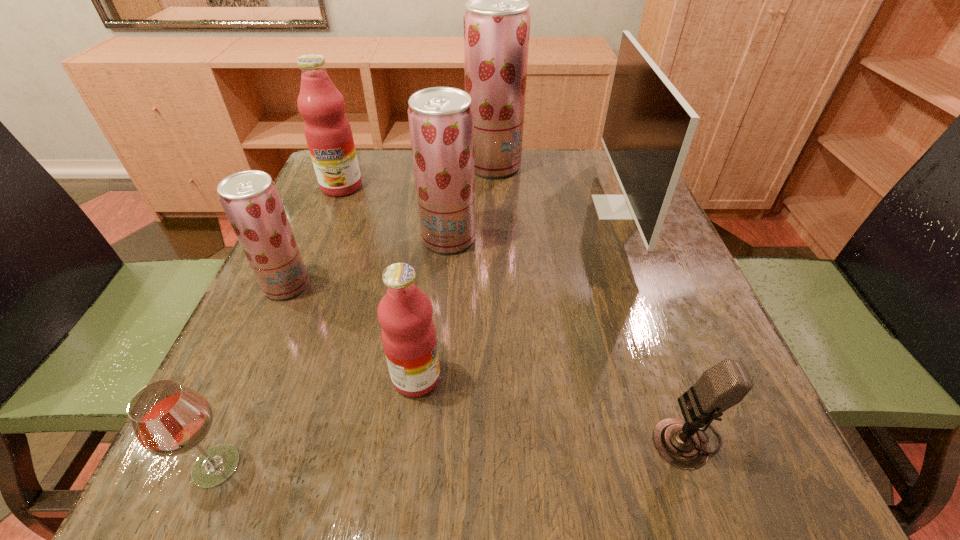
At what (x,y) coordinates should I click in order to perform the action: click on vacant area situated on the label of the nearest fruit juice. Please return your answer as a coordinate pair (x, y). This screenshot has height=540, width=960. Looking at the image, I should click on (517, 377).

At what (x,y) coordinates should I click in order to perform the action: click on vacant space located 0.380m on the front-facing side of the microphone. Please return your answer as a coordinate pair (x, y). This screenshot has height=540, width=960. Looking at the image, I should click on (382, 436).

Where is `vacant space located 0.370m on the front-facing side of the microphone`? This screenshot has height=540, width=960. vacant space located 0.370m on the front-facing side of the microphone is located at coordinates (389, 436).

The height and width of the screenshot is (540, 960). I want to click on free space located on the front-facing side of the microphone, so click(x=524, y=436).

The height and width of the screenshot is (540, 960). What are the coordinates of `blank area located on the back of the wineglass` in the screenshot? It's located at (249, 389).

The image size is (960, 540). Identify the location of monitor located at the far edge. (649, 126).

The width and height of the screenshot is (960, 540). Identify the location of microphone that is at the near edge. 680,442.

Locate an element on the screen. The height and width of the screenshot is (540, 960). wineglass that is at the near edge is located at coordinates (169, 419).

What are the coordinates of `wineglass that is at the left edge` in the screenshot? It's located at (169, 419).

The width and height of the screenshot is (960, 540). What are the coordinates of `monitor that is at the right edge` in the screenshot? It's located at (649, 126).